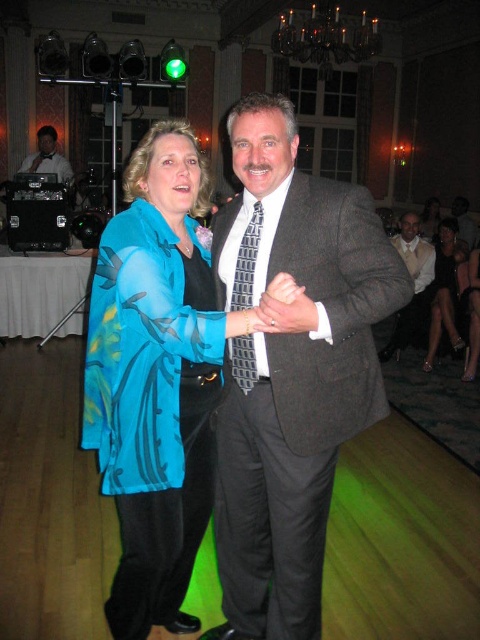
Between matte black dj booth at upper left and matte gray suit at center, which one has less height?

With less height is matte black dj booth at upper left.

Who is lower down, matte black dj booth at upper left or matte gray suit at center?

matte gray suit at center

The width and height of the screenshot is (480, 640). In order to click on matte black dj booth at upper left in this screenshot , I will do `click(48, 157)`.

Where is `matte black dj booth at upper left`? This screenshot has height=640, width=480. matte black dj booth at upper left is located at coordinates tap(48, 157).

From the picture: Which is above, dark gray textured suit at center or matte black dj booth at upper left?

matte black dj booth at upper left is above.

Who is more forward, (242, 435) or (37, 145)?

Point (242, 435)

The width and height of the screenshot is (480, 640). I want to click on dark gray textured suit at center, so click(290, 369).

Between point (228, 134) and point (459, 208), which one is positioned behind?

Positioned behind is point (459, 208).

Between dark gray textured suit at center and matte gray suit at center, which one appears on the left side from the viewer's perspective?

From the viewer's perspective, dark gray textured suit at center appears more on the left side.

Does point (226, 296) come farther from viewer compared to point (474, 228)?

No, (226, 296) is in front of (474, 228).

I want to click on dark gray textured suit at center, so click(x=290, y=369).